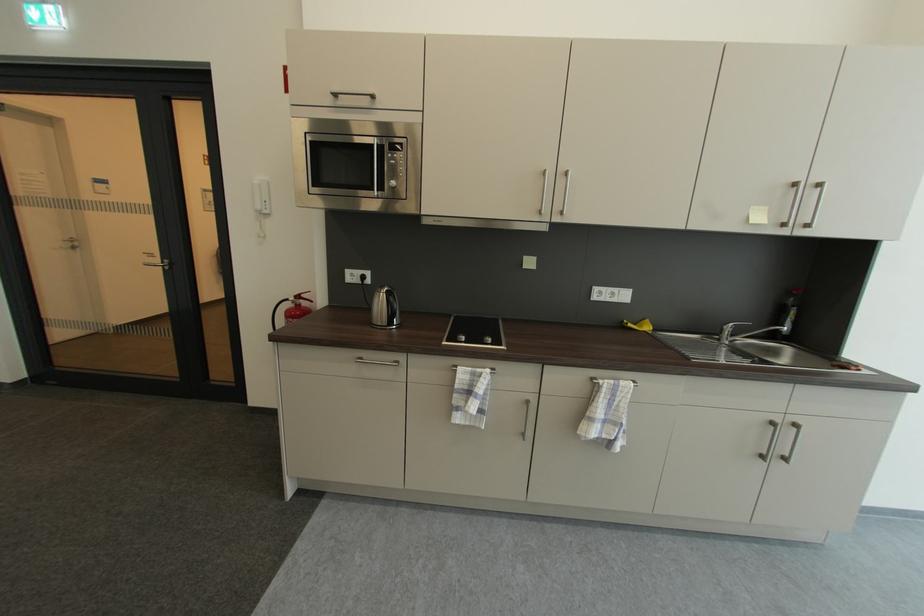
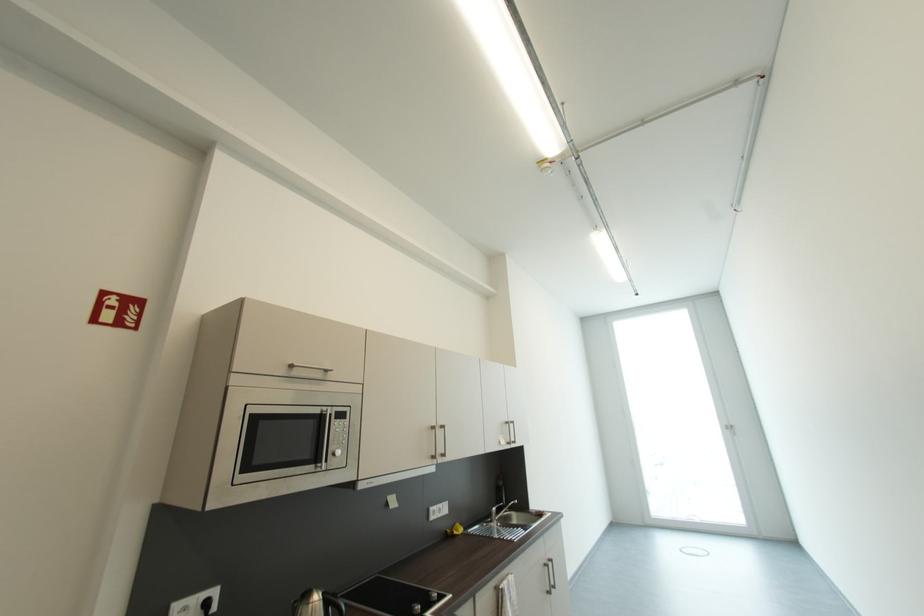
Find the pixel in the second image that matches (342,97) in the first image.

(298, 368)